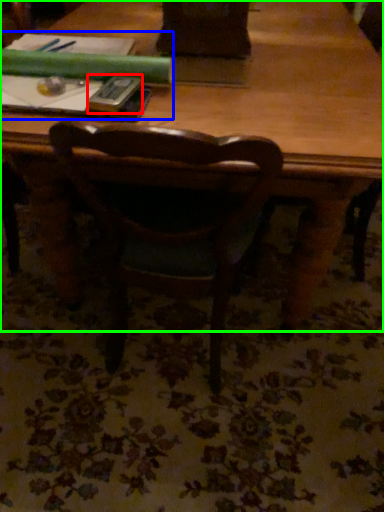
Question: Which object is the closest to the paperback book (highlighted by a red box)? Choose among these: book (highlighted by a blue box) or table (highlighted by a green box).

Choices:
 (A) book
 (B) table

Answer: (A)